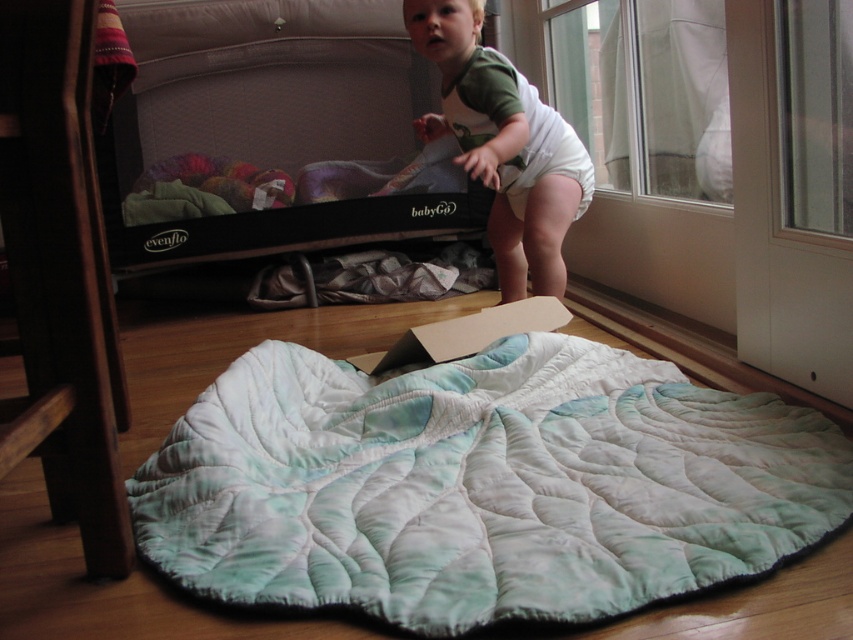
You are a parent who wants to place the white cloth diaper at upper center on top of the quilted fabric at lower center. Can you do this without the diaper falling off the edge?

The quilted fabric at lower center is larger in size than the white cloth diaper at upper center, so yes, the diaper can be placed on top without falling off the edge.

Looking at this image, you are a parent looking to place a new cloth diaper in the babyGo evenflo gate area. The existing items include the quilted fabric at lower center and the white cloth diaper at upper center. Based on their positions, where should you place the new diaper to keep it near the existing one?

The quilted fabric at lower center is to the left of the white cloth diaper at upper center, so placing the new diaper near the white cloth diaper at upper center would keep it close to the existing items.

You are a parent trying to place a toy on the quilted mat. The baby gate is between you and the mat. You have two points marked on the mat. Which point is closer to you, point (607, 541) or point (212, 154)?

Point (212, 154) is closer to you because it is behind point (607, 541), which is in front of it.